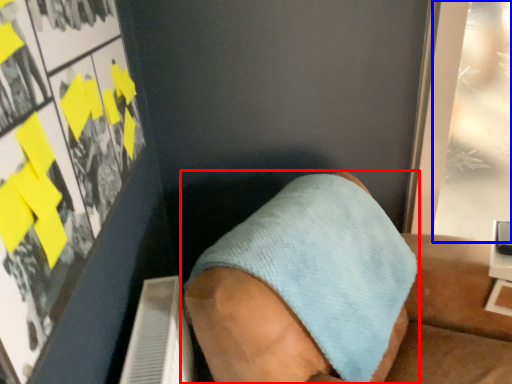
Question: Which point is further to the camera, footwear (highlighted by a red box) or poster page (highlighted by a blue box)?

Choices:
 (A) footwear
 (B) poster page

Answer: (B)